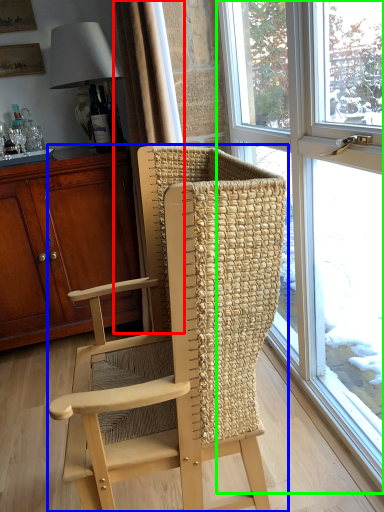
Question: Based on their relative distances, which object is nearer to curtain (highlighted by a red box)? Choose from chair (highlighted by a blue box) and window (highlighted by a green box).

Choices:
 (A) chair
 (B) window

Answer: (A)